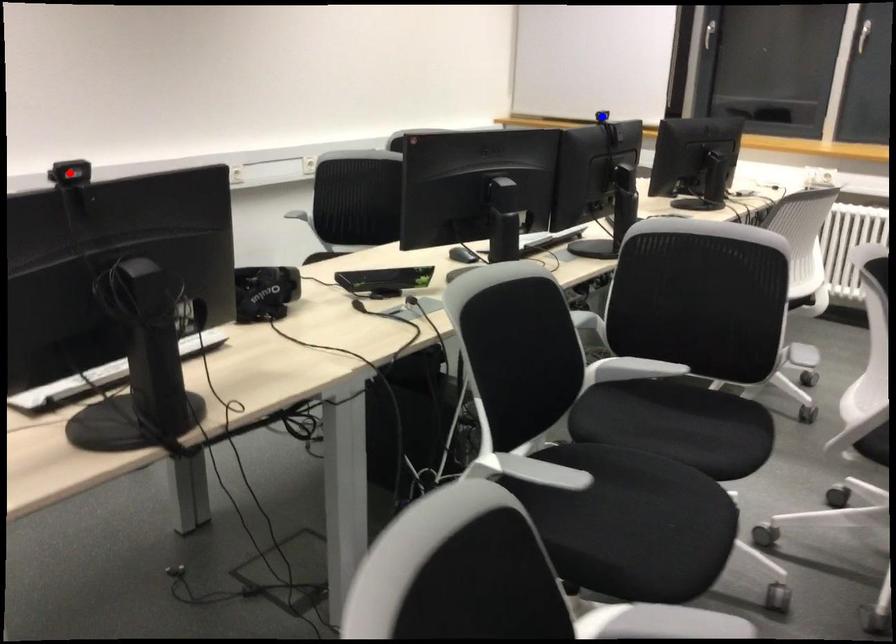
Question: Two points are marked on the image. Which point is closer to the camera?

Choices:
 (A) Blue point is closer.
 (B) Red point is closer.

Answer: (B)